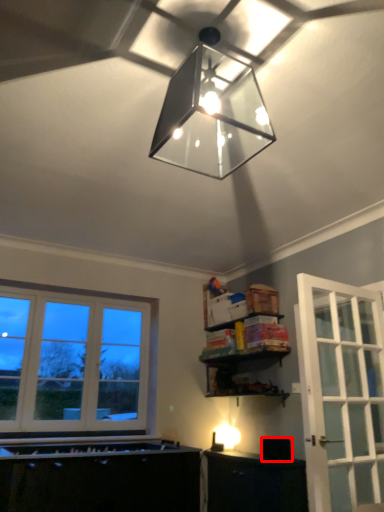
Question: From the image's perspective, considering the relative positions of appliance (annotated by the red box) and lamp in the image provided, where is appliance (annotated by the red box) located with respect to the staircase?

Choices:
 (A) below
 (B) above

Answer: (A)